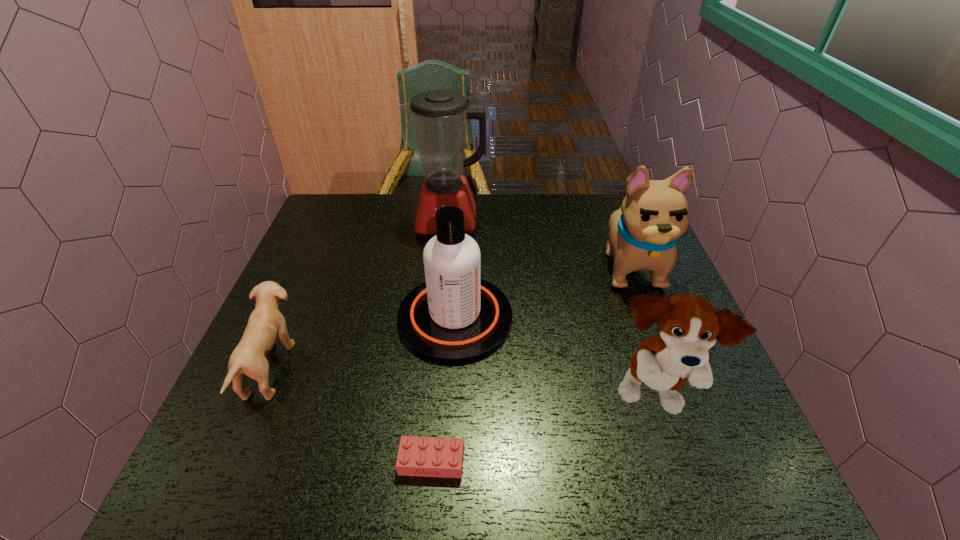
Find the location of `the tallest object`. the tallest object is located at coordinates (439, 117).

You are a GUI agent. You are given a task and a screenshot of the screen. Output one action in this format:
    pyautogui.click(x=<x>, y=<y>)
    Task: Click on the farthest puppy
    
    Given the screenshot: What is the action you would take?
    pyautogui.click(x=643, y=233)

This screenshot has height=540, width=960. Identify the location of cleansing agent. (455, 317).

The image size is (960, 540). I want to click on the shortest puppy, so click(266, 322).

This screenshot has width=960, height=540. Identify the location of the leftmost object. (266, 322).

You are a GUI agent. You are given a task and a screenshot of the screen. Output one action in this format:
    pyautogui.click(x=<x>, y=<y>)
    Task: Click on the Lego
    The height and width of the screenshot is (540, 960).
    Given the screenshot: What is the action you would take?
    pyautogui.click(x=417, y=456)

You are a GUI agent. You are given a task and a screenshot of the screen. Output one action in this format:
    pyautogui.click(x=<x>, y=<y>)
    Task: Click on the shortest object
    
    Given the screenshot: What is the action you would take?
    pyautogui.click(x=417, y=456)

At what (x,y) coordinates should I click in order to perform the action: click on free spot located on the front of the blender near the controls. Please return your answer as a coordinate pair (x, y). Looking at the image, I should click on point(443,275).

Image resolution: width=960 pixels, height=540 pixels. I want to click on vacant space located 0.070m on the face of the farthest puppy, so click(652, 320).

You are a GUI agent. You are given a task and a screenshot of the screen. Output one action in this format:
    pyautogui.click(x=<x>, y=<y>)
    Task: Click on the free space located 0.210m on the back of the cleansing agent
    The width and height of the screenshot is (960, 540).
    Given the screenshot: What is the action you would take?
    pyautogui.click(x=460, y=233)